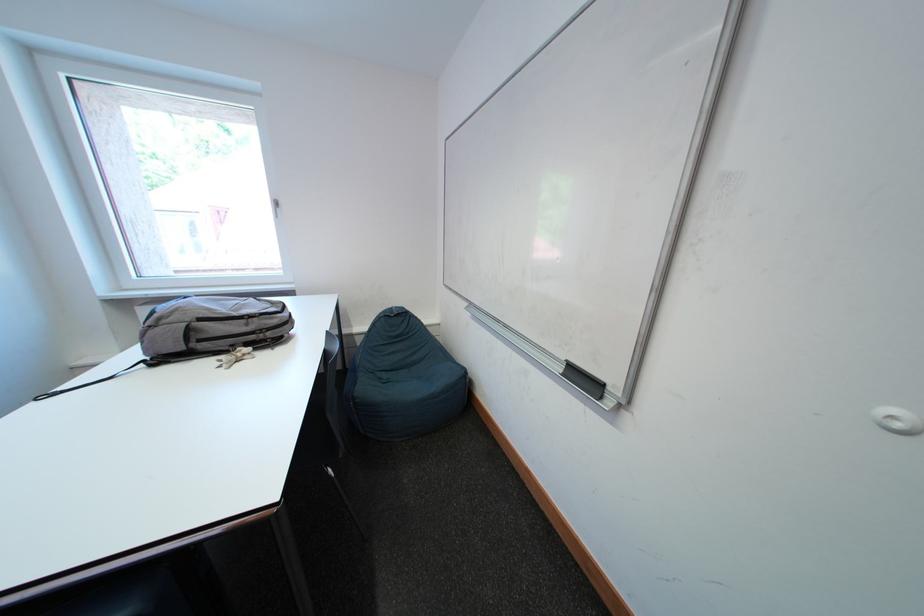
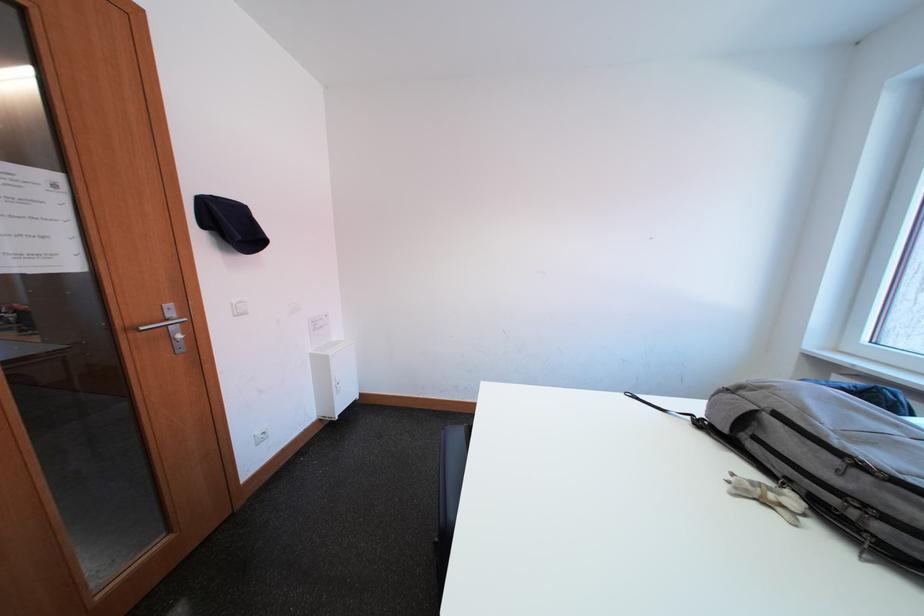
Locate, in the second image, the point that corresponds to [178,366] in the first image.

(719, 438)